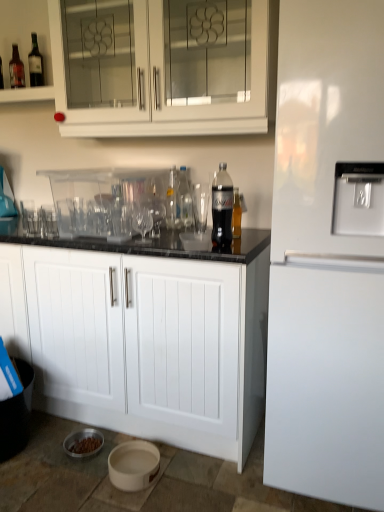
Where is `free spot in front of transparent glass wine glass at center, the 1th wine glass in the left-to-right sequence`? free spot in front of transparent glass wine glass at center, the 1th wine glass in the left-to-right sequence is located at coordinates (144, 249).